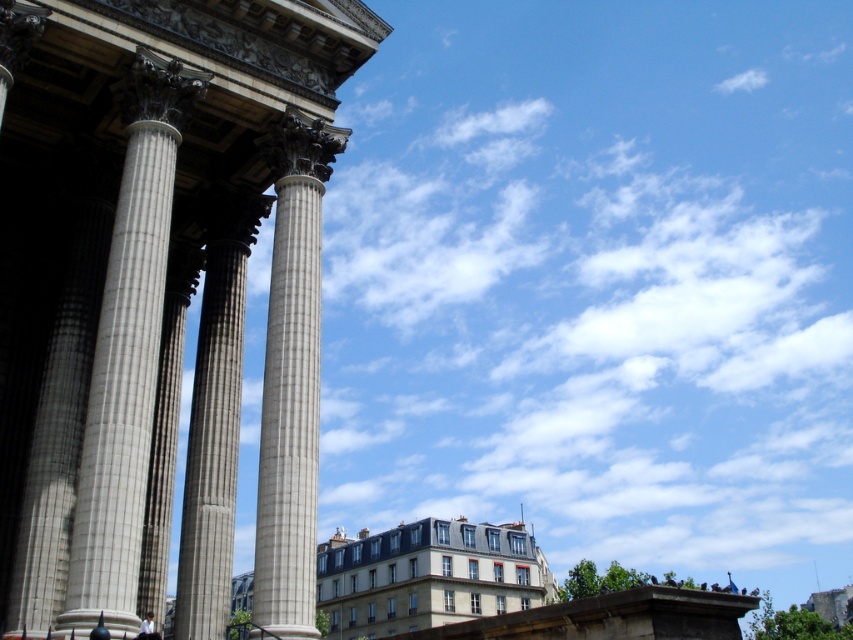
You are an architect analyzing the structural integrity of the columns in the scene. Based on their positions, which column, the white marble column at left or the gray stone column at center, is placed higher relative to the other?

The white marble column at left is positioned over the gray stone column at center, meaning it is higher in elevation.

You are standing in front of a classical building with columns. There is a point marked at coordinates (126, 355). Which object from the scene does this point belong to?

The point at coordinates (126, 355) is located on the white marble column at left.